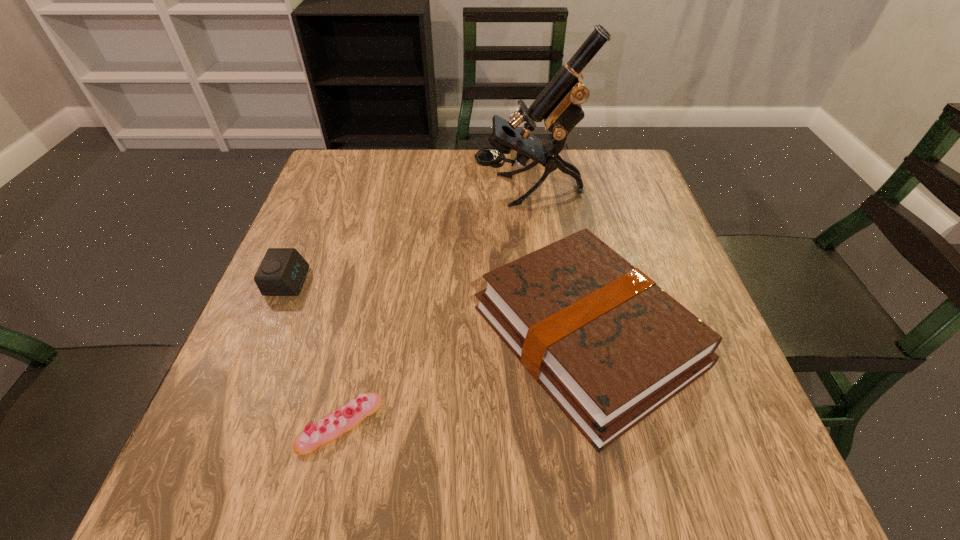
Where is `free space between the farthest object and the leftmost object`? Image resolution: width=960 pixels, height=540 pixels. free space between the farthest object and the leftmost object is located at coordinates (408, 236).

I want to click on free area in between the hardback book and the second shortest object, so click(438, 309).

Locate an element on the screen. This screenshot has width=960, height=540. free area in between the alarm clock and the tallest object is located at coordinates (408, 236).

Locate an element on the screen. The width and height of the screenshot is (960, 540). vacant space that's between the eclair and the third tallest object is located at coordinates (314, 353).

Where is `vacant space in between the eclair and the third shortest object`? This screenshot has width=960, height=540. vacant space in between the eclair and the third shortest object is located at coordinates (464, 380).

Identify the location of vacant region between the tallest object and the eclair. Image resolution: width=960 pixels, height=540 pixels. (434, 307).

Locate an element on the screen. The height and width of the screenshot is (540, 960). free space that is in between the second shortest object and the tallest object is located at coordinates (408, 236).

Identify the location of object that stands as the closest to the microscope. click(610, 347).

Point out which object is positioned as the nearest to the microscope. Please provide its 2D coordinates. Your answer should be formatted as a tuple, i.e. [(x, y)], where the tuple contains the x and y coordinates of a point satisfying the conditions above.

[(610, 347)]

This screenshot has width=960, height=540. I want to click on free location that satisfies the following two spatial constraints: 1. through the eyepiece of the microscope; 2. on the left side of the hardback book, so click(x=547, y=336).